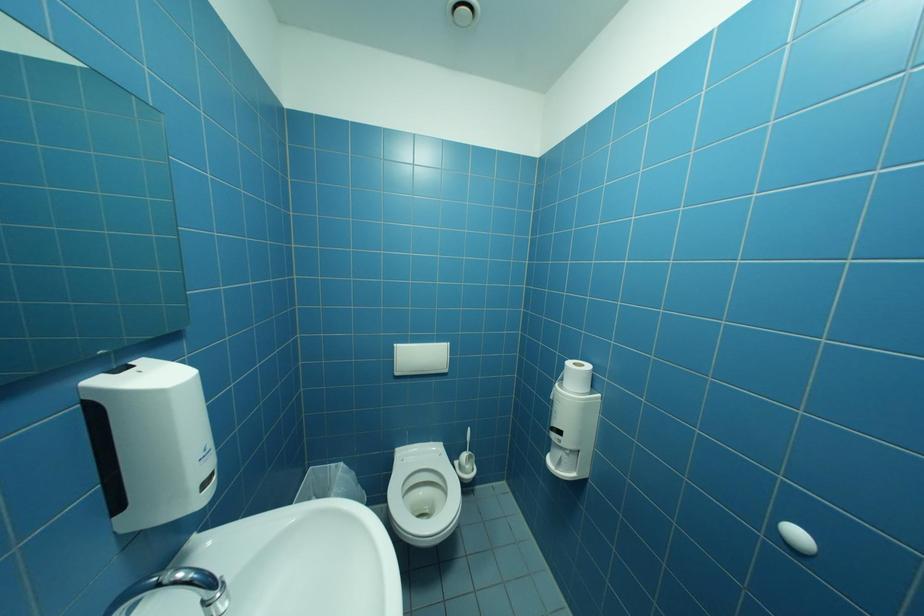
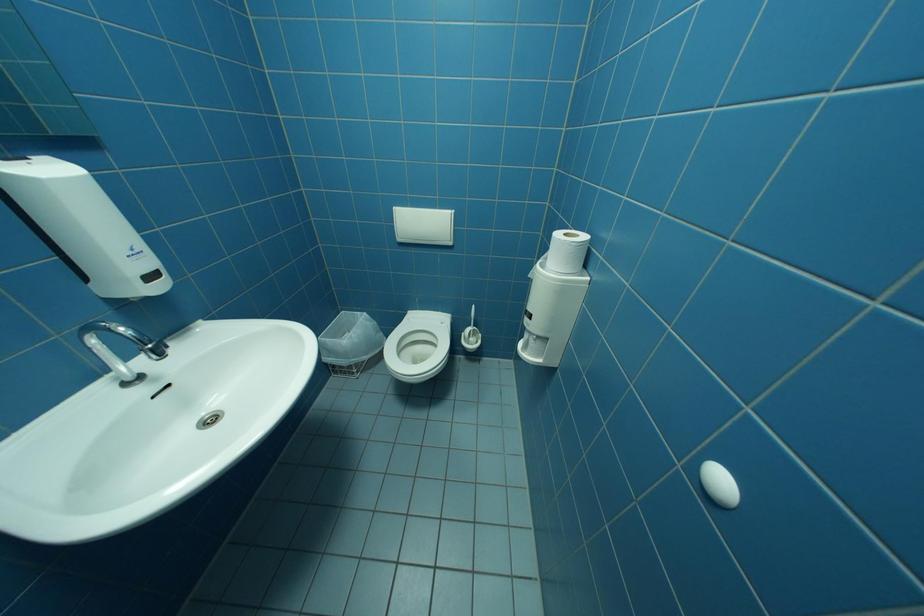
First-person continuous shooting, in which direction is the camera rotating?

The rotation direction of the camera is left-down.